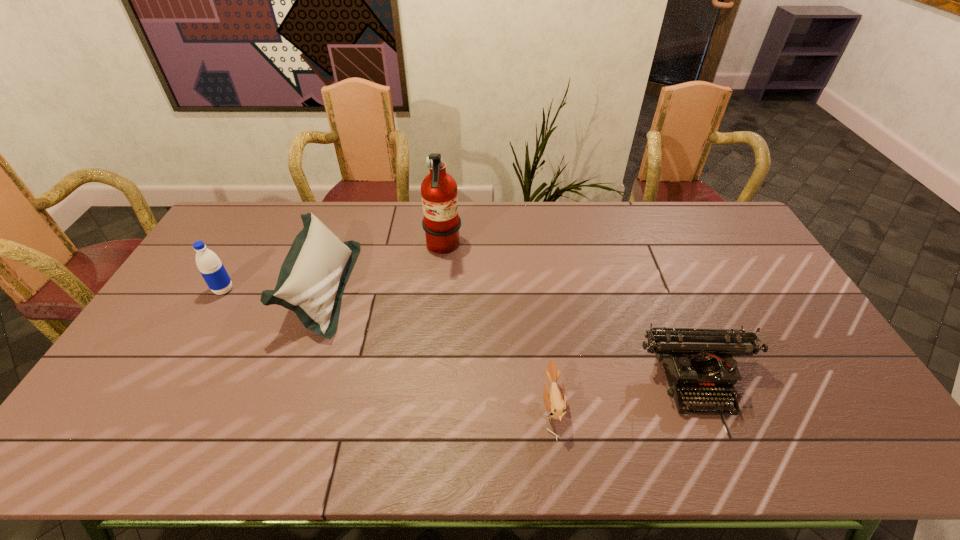
Identify the location of vacant space located 0.050m on the surface of the second object from left to right. The width and height of the screenshot is (960, 540). (365, 289).

Where is `vacant space positioned at the beak of the bird`? This screenshot has height=540, width=960. vacant space positioned at the beak of the bird is located at coordinates (390, 407).

You are a GUI agent. You are given a task and a screenshot of the screen. Output one action in this format:
    pyautogui.click(x=<x>, y=<y>)
    Task: Click on the vacant space situated 0.190m at the beak of the bird
    
    Given the screenshot: What is the action you would take?
    pyautogui.click(x=466, y=407)

Identify the location of vacant space located 0.090m at the beak of the bird. (506, 407).

At what (x,y) coordinates should I click in order to perform the action: click on object situated at the far edge. Please return your answer as a coordinate pair (x, y). Looking at the image, I should click on (441, 223).

This screenshot has height=540, width=960. Identify the location of object that is at the near edge. (555, 402).

The height and width of the screenshot is (540, 960). I want to click on object located at the left edge, so pyautogui.click(x=211, y=268).

The height and width of the screenshot is (540, 960). I want to click on free spot at the far edge of the desktop, so click(323, 213).

This screenshot has width=960, height=540. I want to click on vacant region at the near edge of the desktop, so click(287, 445).

Identify the location of blank space at the left edge. (146, 346).